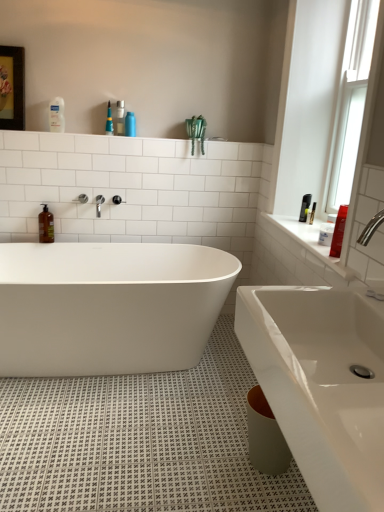
Question: Considering the relative sizes of white glossy lotion at upper left, which ranks as the second toiletry in right-to-left order, and clear glass window at upper right in the image provided, is white glossy lotion at upper left, which ranks as the second toiletry in right-to-left order, taller than clear glass window at upper right?

Choices:
 (A) yes
 (B) no

Answer: (B)

Question: Is white glossy lotion at upper left, the 1th toiletry positioned from the top, further to the viewer compared to clear glass window at upper right?

Choices:
 (A) no
 (B) yes

Answer: (B)

Question: Considering the relative sizes of white glossy lotion at upper left, the 1th toiletry positioned from the top, and clear glass window at upper right in the image provided, is white glossy lotion at upper left, the 1th toiletry positioned from the top, shorter than clear glass window at upper right?

Choices:
 (A) yes
 (B) no

Answer: (A)

Question: Is clear glass window at upper right a part of white glossy lotion at upper left, the first toiletry viewed from the back?

Choices:
 (A) no
 (B) yes

Answer: (A)

Question: From the image's perspective, is white glossy lotion at upper left, which is the second toiletry from bottom to top, on clear glass window at upper right?

Choices:
 (A) no
 (B) yes

Answer: (B)

Question: Is white glossy lotion at upper left, the 1th toiletry positioned from the top, thinner than clear glass window at upper right?

Choices:
 (A) no
 (B) yes

Answer: (B)

Question: Can you confirm if white glossy sink at lower right is smaller than white glossy lotion at upper left, the first toiletry viewed from the back?

Choices:
 (A) no
 (B) yes

Answer: (A)

Question: Is white glossy sink at lower right wider than white glossy lotion at upper left, the 1th toiletry positioned from the top?

Choices:
 (A) yes
 (B) no

Answer: (A)

Question: Is the depth of white glossy sink at lower right greater than that of white glossy lotion at upper left, which ranks as the second toiletry in front-to-back order?

Choices:
 (A) no
 (B) yes

Answer: (A)

Question: Is white glossy sink at lower right completely or partially outside of white glossy lotion at upper left, which ranks as the second toiletry in front-to-back order?

Choices:
 (A) no
 (B) yes

Answer: (B)

Question: From the image's perspective, would you say white glossy sink at lower right is shown under white glossy lotion at upper left, which is the second toiletry from bottom to top?

Choices:
 (A) yes
 (B) no

Answer: (A)

Question: From a real-world perspective, is white glossy sink at lower right physically above white glossy lotion at upper left, the first toiletry viewed from the back?

Choices:
 (A) yes
 (B) no

Answer: (B)

Question: Does white glossy bathtub at center lie behind brown glass soap dispenser at left?

Choices:
 (A) yes
 (B) no

Answer: (B)